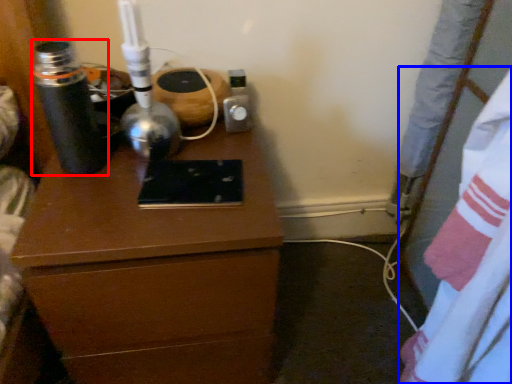
Question: Which object appears farthest to the camera in this image, bottle (highlighted by a red box) or sheet (highlighted by a blue box)?

Choices:
 (A) bottle
 (B) sheet

Answer: (A)